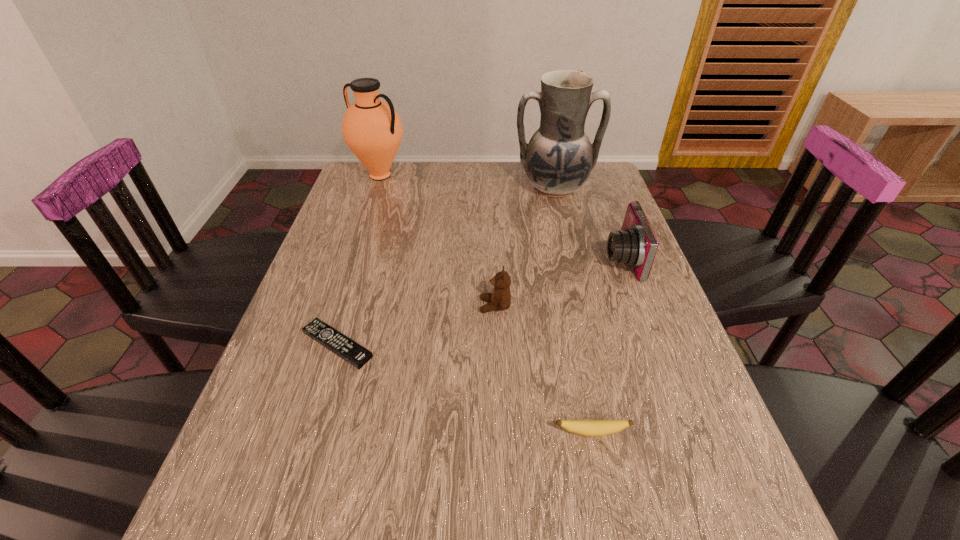
Identify the location of pitcher that is at the right edge. (558, 160).

Locate an element on the screen. The height and width of the screenshot is (540, 960). camera at the right edge is located at coordinates (635, 244).

This screenshot has height=540, width=960. I want to click on banana at the right edge, so click(x=593, y=428).

Find the location of `object that is at the far left corner`. object that is at the far left corner is located at coordinates (372, 129).

Identify the location of object situated at the far right corner. (558, 160).

In the image, there is a desktop. What are the coordinates of `vacant region at the far edge` in the screenshot? It's located at (415, 166).

You are a GUI agent. You are given a task and a screenshot of the screen. Output one action in this format:
    pyautogui.click(x=<x>, y=<y>)
    Task: Click on the vacant space at the left edge of the desktop
    
    Given the screenshot: What is the action you would take?
    pyautogui.click(x=259, y=416)

Identify the location of blank space at the right edge. The width and height of the screenshot is (960, 540). (598, 229).

Find the location of `vacant space at the far left corner`. vacant space at the far left corner is located at coordinates (394, 165).

In the image, there is a desktop. Identify the location of vacant space at the far right corner. Image resolution: width=960 pixels, height=540 pixels. (582, 195).